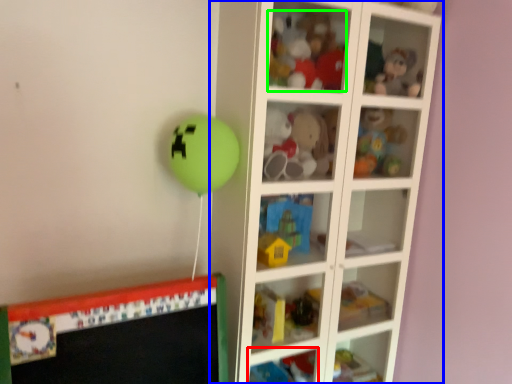
Question: Which object is the closest to the cabinet (highlighted by a red box)? Choose among these: shelf (highlighted by a blue box) or toy (highlighted by a green box).

Choices:
 (A) shelf
 (B) toy

Answer: (A)